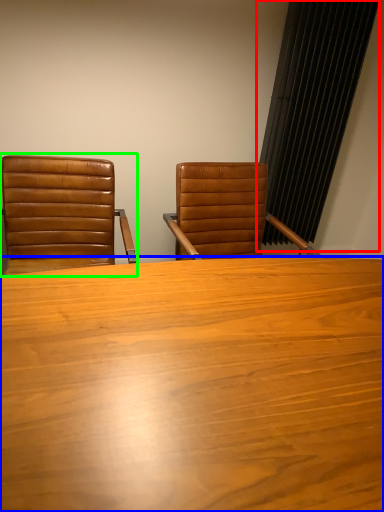
Question: Based on their relative distances, which object is farther from curtain (highlighted by a red box)? Choose from table (highlighted by a blue box) and chair (highlighted by a green box).

Choices:
 (A) table
 (B) chair

Answer: (A)